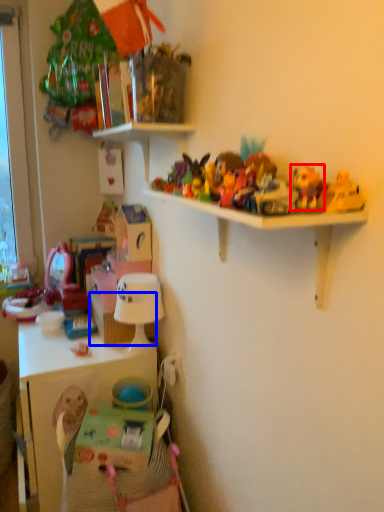
Question: Which of the following is the farthest to the observer, toy (highlighted by a red box) or basket (highlighted by a blue box)?

Choices:
 (A) toy
 (B) basket

Answer: (B)